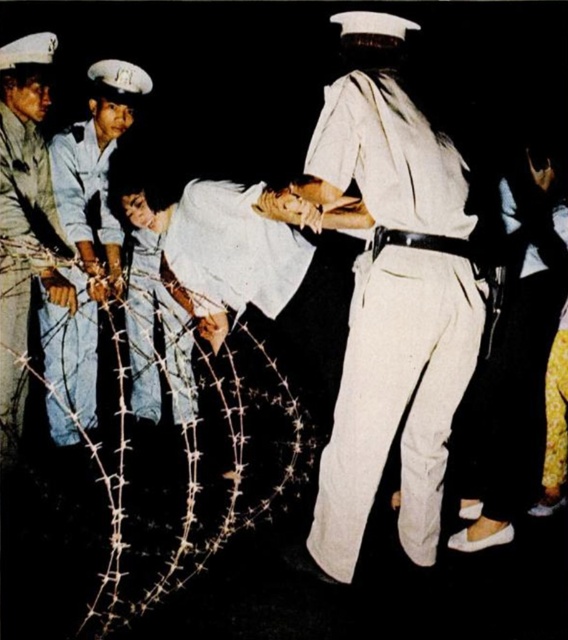
You are a security guard observing the scene. You notice the jeans at left and the black leather belt at center. Which object is positioned further to the left side of the image?

The jeans at left is positioned further to the left side of the image compared to the black leather belt at center.

You are a drone operator trying to capture a clear image of two specific points in the scene. The points are labeled as point (94, 257) and point (2, 403). Given their positions relative to the camera, which point is closer to the camera?

Point (94, 257) is further to the camera than point (2, 403), so the closer point to the camera is point (2, 403).